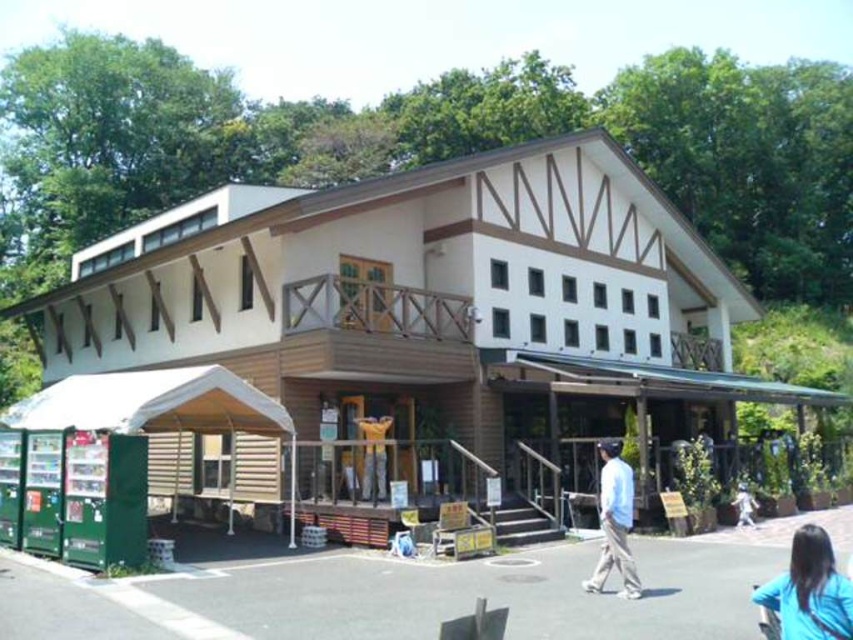
Is wooden statue at center bigger than white cotton shirt at lower right?

Yes.

Between wooden statue at center and white cotton shirt at lower right, which one is positioned lower?

Positioned lower is white cotton shirt at lower right.

Identify the location of wooden statue at center. (373, 456).

Does point (598, 448) come behind point (741, 512)?

Yes, point (598, 448) is farther from viewer.

Who is more distant from viewer, [607,570] or [741,499]?

The point [741,499] is more distant.

Does point (630, 486) lie in front of point (737, 504)?

Yes, point (630, 486) is in front of point (737, 504).

This screenshot has width=853, height=640. I want to click on light blue shirt at center, so click(x=614, y=522).

Does blue fabric shirt at lower right appear under light blue shirt at center?

No.

Does blue fabric shirt at lower right have a larger size compared to light blue shirt at center?

No, blue fabric shirt at lower right is not bigger than light blue shirt at center.

Is point (840, 611) in front of point (601, 490)?

Yes.

The image size is (853, 640). I want to click on blue fabric shirt at lower right, so click(809, 589).